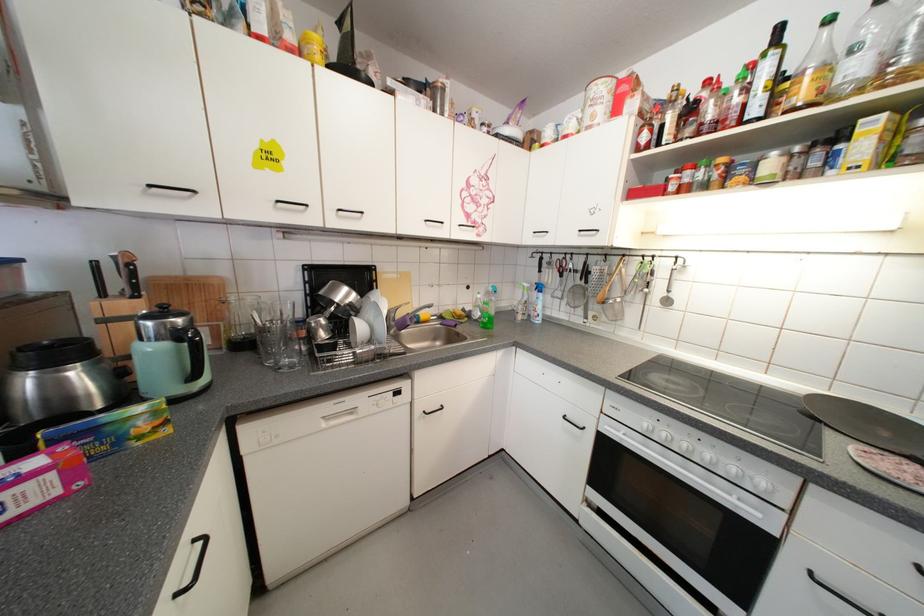
Locate an element on the screen. This screenshot has height=616, width=924. sink faucet handle is located at coordinates (399, 305).